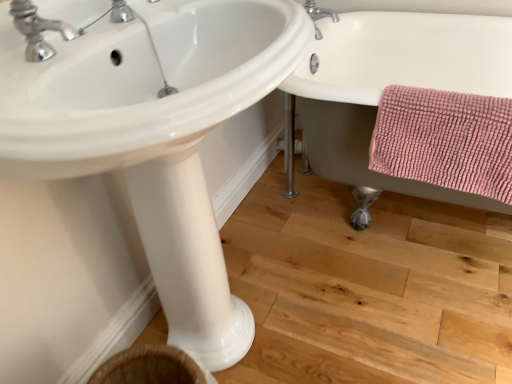
Where is `vacant space to the right of white glossy sink at center`? Image resolution: width=512 pixels, height=384 pixels. vacant space to the right of white glossy sink at center is located at coordinates (385, 327).